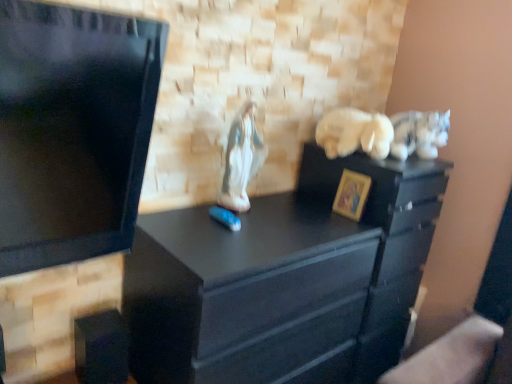
Where is `vacant area that lies between porcelain statue at center, which is the 3th animal in right-to-left order, and gold painted wood picture frame at center right`? This screenshot has width=512, height=384. vacant area that lies between porcelain statue at center, which is the 3th animal in right-to-left order, and gold painted wood picture frame at center right is located at coordinates (285, 218).